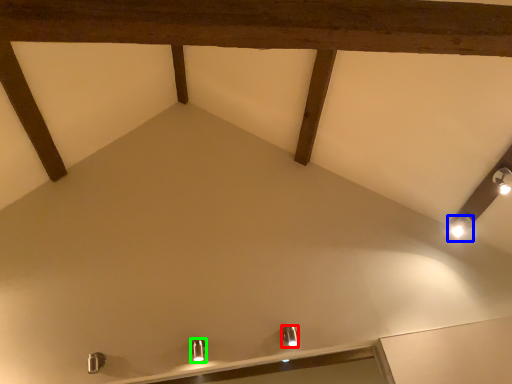
Question: Based on their relative distances, which object is nearer to light fixture (highlighted by a red box)? Choose from light fixture (highlighted by a blue box) and light fixture (highlighted by a green box).

Choices:
 (A) light fixture
 (B) light fixture

Answer: (B)